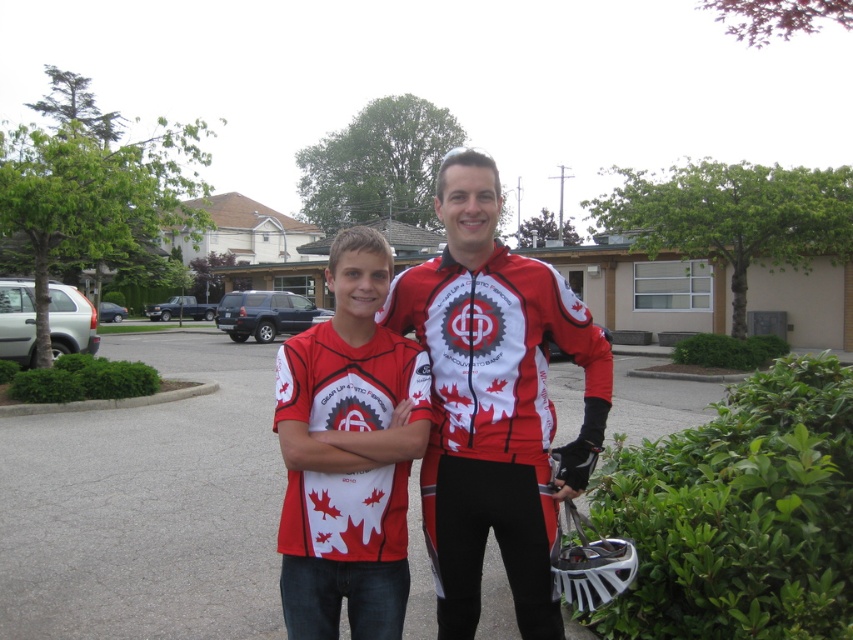
You are a photographer trying to capture a clear shot of both the matte red cycling jersey at center and the matte red jersey at center. Which one is closer to the camera?

The matte red cycling jersey at center is closer to the camera than the matte red jersey at center.